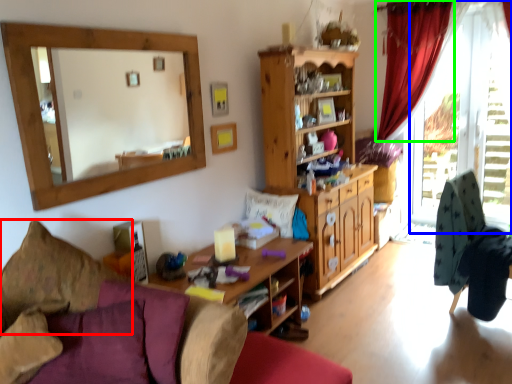
Question: Which object is positioned closest to pillow (highlighted by a red box)? Select from window frame (highlighted by a blue box) and curtain (highlighted by a green box).

Choices:
 (A) window frame
 (B) curtain

Answer: (B)